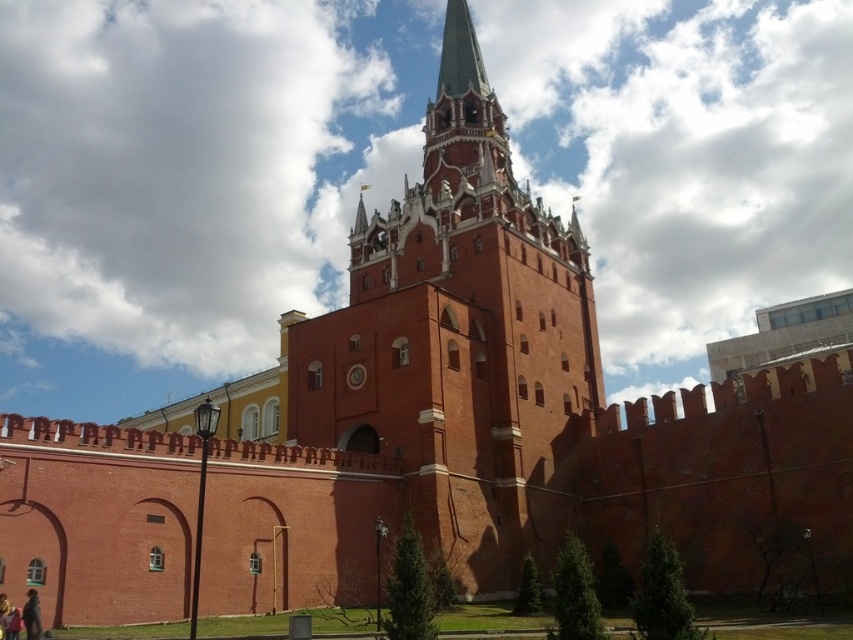
You are standing in front of the fortress and want to place a small decorative item on the dark brown leather jacket at lower left. Will the red brick tower at center block your view of the jacket?

The red brick tower at center is positioned over dark brown leather jacket at lower left, so the tower will block your view of the jacket.

You are standing in front of the fortress structure. There are two points marked on the ground in front of you. One is at coordinates point (392, 416) and the other at point (22, 609). If you were to walk towards the fortress, which point would you encounter first?

Point (22, 609) would be encountered first because it is in front of point (392, 416), which is positioned behind it relative to the fortress.